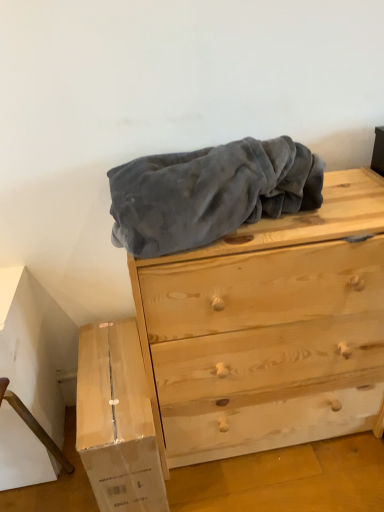
This screenshot has height=512, width=384. Find the location of `empty space that is ontop of white cardboard box at lower left (from a real-world perspective)`. empty space that is ontop of white cardboard box at lower left (from a real-world perspective) is located at coordinates (105, 372).